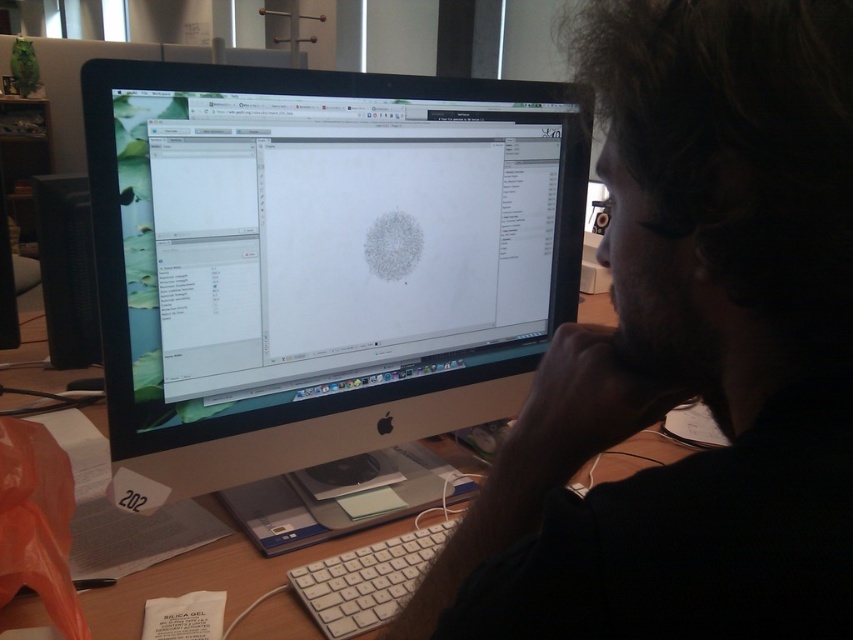
Question: Estimate the real-world distances between objects in this image. Which object is farther from the white plastic keyboard at lower center?

Choices:
 (A) black matte monitor at center
 (B) black plastic desktop computer at left
 (C) black glossy monitor at center

Answer: (B)

Question: Is the position of black plastic desktop computer at left less distant than that of white plastic keyboard at lower center?

Choices:
 (A) no
 (B) yes

Answer: (A)

Question: Which point is closer to the camera taking this photo?

Choices:
 (A) (374, 592)
 (B) (77, 314)
 (C) (728, 134)
 (D) (354, 344)

Answer: (C)

Question: Is black glossy monitor at center positioned behind white plastic keyboard at lower center?

Choices:
 (A) no
 (B) yes

Answer: (A)

Question: Can you confirm if black matte monitor at center is positioned above black glossy monitor at center?

Choices:
 (A) yes
 (B) no

Answer: (B)

Question: Among these objects, which one is farthest from the camera?

Choices:
 (A) white plastic keyboard at lower center
 (B) black matte monitor at center

Answer: (A)